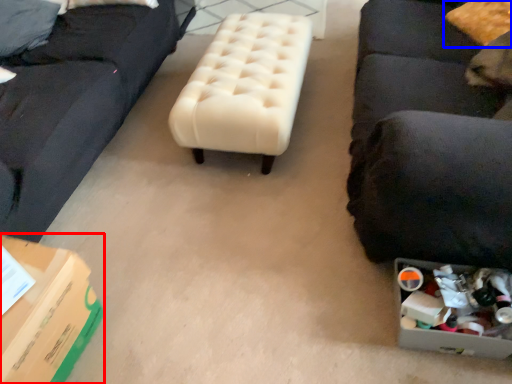
Question: Among these objects, which one is nearest to the camera, cardboard box (highlighted by a red box) or pillow (highlighted by a blue box)?

Choices:
 (A) cardboard box
 (B) pillow

Answer: (A)